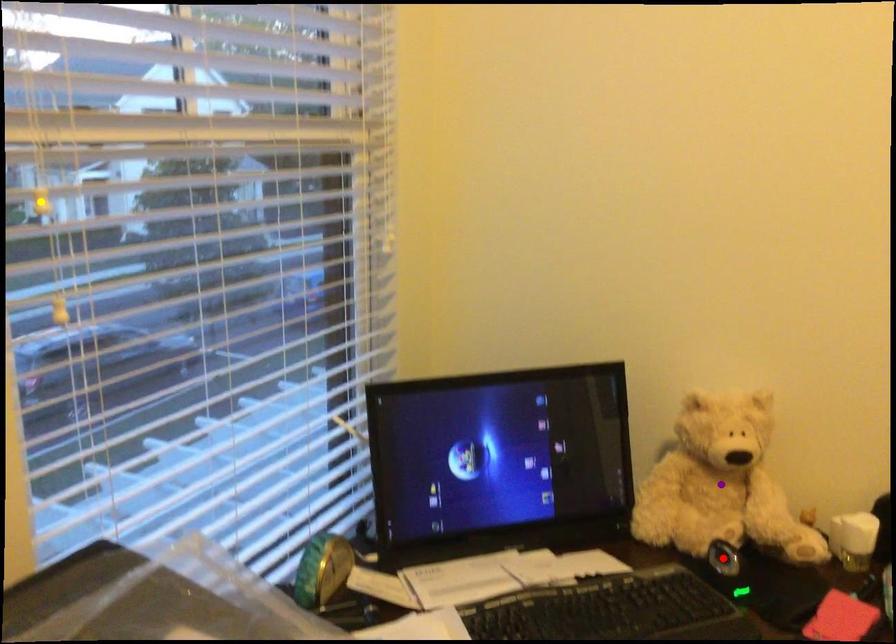
Order these from nearest to farthest:
1. purple point
2. red point
3. yellow point

1. yellow point
2. red point
3. purple point